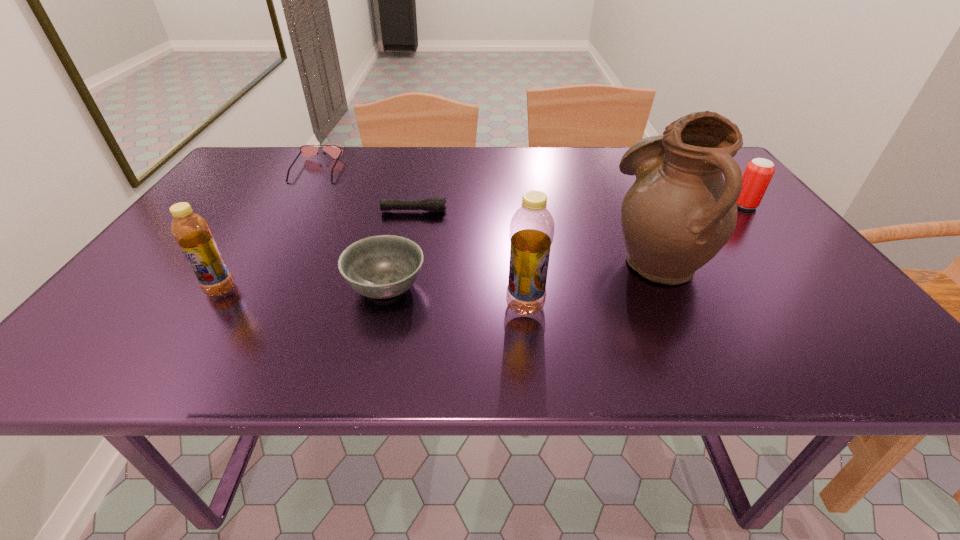
What are the coordinates of `the third tallest object` in the screenshot? It's located at (191, 231).

Where is `the left bottle`? The width and height of the screenshot is (960, 540). the left bottle is located at coordinates (191, 231).

Identify the location of the right bottle. (532, 227).

Identify the location of the taller bottle. The height and width of the screenshot is (540, 960). (532, 227).

At what (x,y) coordinates should I click in order to perform the action: click on beer can. Please return your answer as a coordinate pair (x, y). The width and height of the screenshot is (960, 540). Looking at the image, I should click on (758, 173).

Identify the location of the rightmost object. (758, 173).

Where is `the second shortest object`? The height and width of the screenshot is (540, 960). the second shortest object is located at coordinates (305, 150).

Where is `the farthest object`? The width and height of the screenshot is (960, 540). the farthest object is located at coordinates (305, 150).

Where is `the shortest object`? The height and width of the screenshot is (540, 960). the shortest object is located at coordinates (436, 204).

You are a GUI agent. You are given a task and a screenshot of the screen. Output one action in this format:
    pyautogui.click(x=<x>, y=<y>)
    Task: Click on the second object from right to left
    The image size is (960, 540).
    Given the screenshot: What is the action you would take?
    pyautogui.click(x=679, y=213)